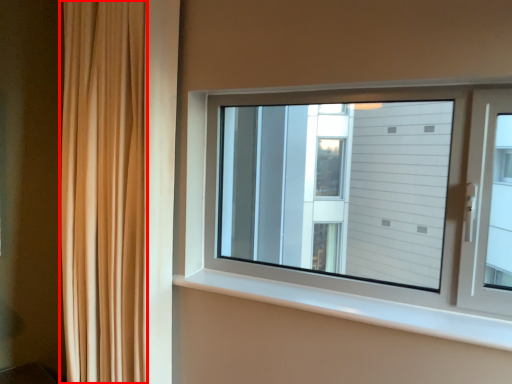
Question: From the image's perspective, what is the correct spatial relationship of curtain (annotated by the red box) in relation to window sill?

Choices:
 (A) above
 (B) below

Answer: (A)